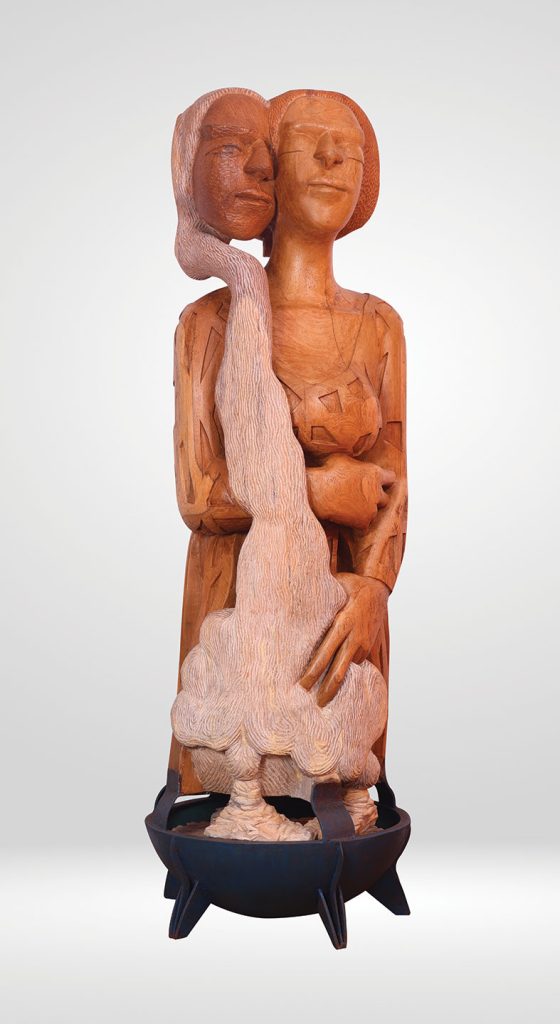
Identify the location of wood tan statue. (311, 170).